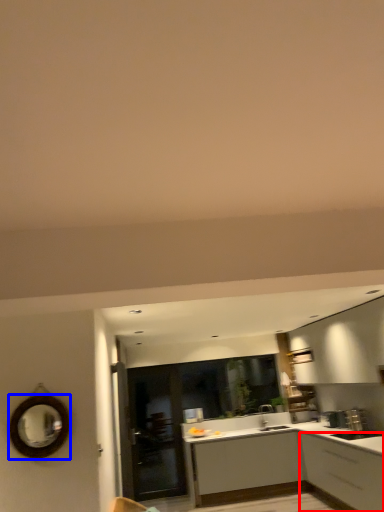
Question: Which point is closer to the camera, cabinetry (highlighted by a red box) or mirror (highlighted by a blue box)?

Choices:
 (A) cabinetry
 (B) mirror

Answer: (B)